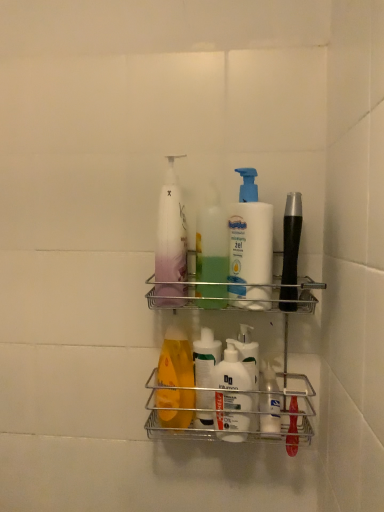
Question: Is white matte lotion at center, the 1th cleaning product in the right-to-left sequence, smaller than metallic silver shelf at center?

Choices:
 (A) no
 (B) yes

Answer: (B)

Question: From the image's perspective, is white matte lotion at center, the 1th cleaning product in the right-to-left sequence, on top of metallic silver shelf at center?

Choices:
 (A) yes
 (B) no

Answer: (A)

Question: Can you confirm if white matte lotion at center, the 1th cleaning product in the right-to-left sequence, is thinner than metallic silver shelf at center?

Choices:
 (A) yes
 (B) no

Answer: (A)

Question: From the image's perspective, is white matte lotion at center, the 1th cleaning product in the right-to-left sequence, located beneath metallic silver shelf at center?

Choices:
 (A) yes
 (B) no

Answer: (B)

Question: From a real-world perspective, does white matte lotion at center, which is the 3th cleaning product in left-to-right order, stand above metallic silver shelf at center?

Choices:
 (A) yes
 (B) no

Answer: (A)

Question: From a real-world perspective, is white matte lotion at center, which is the 3th cleaning product in left-to-right order, under metallic silver shelf at center?

Choices:
 (A) no
 (B) yes

Answer: (A)

Question: Is white matte lotion at center, which is the 3th cleaning product in left-to-right order, shorter than translucent plastic pump bottle at center, which is the third cleaning product from right to left?

Choices:
 (A) yes
 (B) no

Answer: (A)

Question: Is white matte lotion at center, which is the 3th cleaning product in left-to-right order, taller than translucent plastic pump bottle at center, which is the third cleaning product from right to left?

Choices:
 (A) no
 (B) yes

Answer: (A)

Question: Is white matte lotion at center, which is the 3th cleaning product in left-to-right order, not near translucent plastic pump bottle at center, which is the first cleaning product in left-to-right order?

Choices:
 (A) yes
 (B) no

Answer: (B)

Question: Can you confirm if white matte lotion at center, which is the 3th cleaning product in left-to-right order, is bigger than translucent plastic pump bottle at center, which is the third cleaning product from right to left?

Choices:
 (A) no
 (B) yes

Answer: (A)

Question: Could you tell me if white matte lotion at center, the 1th cleaning product in the right-to-left sequence, is turned towards translucent plastic pump bottle at center, which is the third cleaning product from right to left?

Choices:
 (A) yes
 (B) no

Answer: (B)

Question: Considering the relative positions of white matte lotion at center, the 1th cleaning product in the right-to-left sequence, and translucent plastic pump bottle at center, which is the third cleaning product from right to left, in the image provided, is white matte lotion at center, the 1th cleaning product in the right-to-left sequence, to the right of translucent plastic pump bottle at center, which is the third cleaning product from right to left, from the viewer's perspective?

Choices:
 (A) no
 (B) yes

Answer: (B)

Question: Considering the relative positions of translucent plastic pump bottle at center, which is the third cleaning product from right to left, and white matte lotion at center, the 1th cleaning product in the right-to-left sequence, in the image provided, is translucent plastic pump bottle at center, which is the third cleaning product from right to left, in front of white matte lotion at center, the 1th cleaning product in the right-to-left sequence,?

Choices:
 (A) no
 (B) yes

Answer: (A)